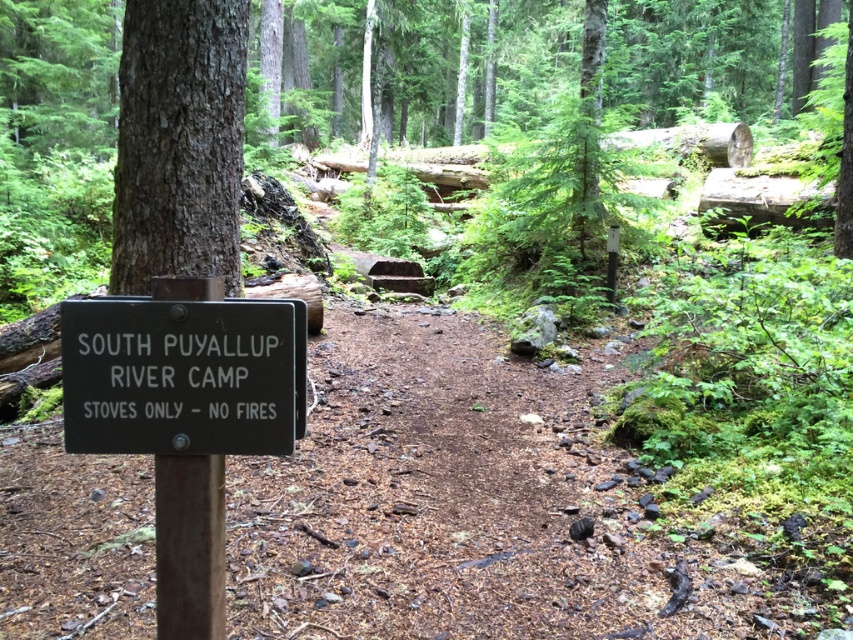
Between point (202, 336) and point (151, 4), which one is positioned behind?

The point (151, 4) is more distant.

This screenshot has width=853, height=640. What do you see at coordinates (183, 376) in the screenshot?
I see `black wood sign at left` at bounding box center [183, 376].

Which is in front, point (119, 388) or point (192, 260)?

Point (119, 388) is in front.

You are a GUI agent. You are given a task and a screenshot of the screen. Output one action in this format:
    pyautogui.click(x=<x>, y=<y>)
    Task: Click on the black wood sign at left
    
    Given the screenshot: What is the action you would take?
    pyautogui.click(x=183, y=376)